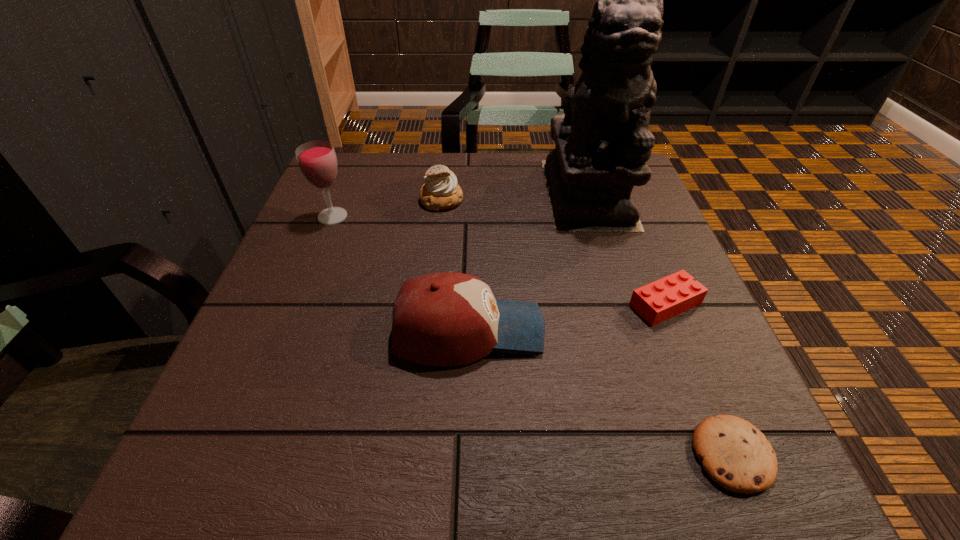
Where is `cookie positioned at the right edge`? The image size is (960, 540). cookie positioned at the right edge is located at coordinates (736, 455).

Locate an element on the screen. object that is at the far right corner is located at coordinates (603, 142).

Identify the location of object that is at the near right corner. This screenshot has width=960, height=540. (736, 455).

In order to click on vacant space at the far edge in this screenshot , I will do `click(412, 184)`.

Identify the location of vacant region at the near edge. The width and height of the screenshot is (960, 540). (349, 489).

In the image, there is a desktop. Where is `vacant space at the left edge`? vacant space at the left edge is located at coordinates (307, 426).

The height and width of the screenshot is (540, 960). Find the location of `free point at the right edge`. free point at the right edge is located at coordinates (646, 399).

This screenshot has width=960, height=540. In the image, there is a desktop. Find the location of `vacant space at the far left corner`. vacant space at the far left corner is located at coordinates (318, 201).

The width and height of the screenshot is (960, 540). In order to click on vacant space at the near left corner in this screenshot , I will do `click(219, 478)`.

This screenshot has height=540, width=960. I want to click on free space between the sculpture and the second tallest object, so click(x=460, y=205).